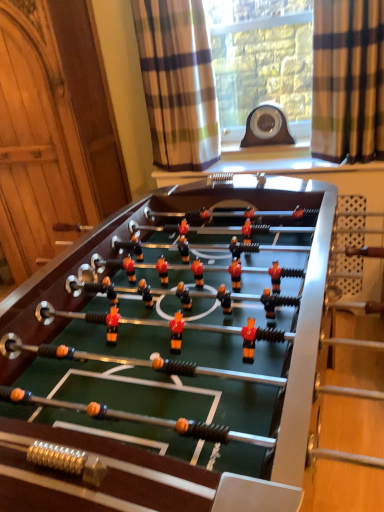
Question: Is plaid fabric curtain at upper center, the first curtain viewed from the left, at the right side of green felt table at center?

Choices:
 (A) no
 (B) yes

Answer: (A)

Question: Can you confirm if plaid fabric curtain at upper center, arranged as the 2th curtain when viewed from the right, is taller than green felt table at center?

Choices:
 (A) yes
 (B) no

Answer: (B)

Question: Does plaid fabric curtain at upper center, arranged as the 2th curtain when viewed from the right, have a smaller size compared to green felt table at center?

Choices:
 (A) no
 (B) yes

Answer: (B)

Question: Is plaid fabric curtain at upper center, arranged as the 2th curtain when viewed from the right, oriented away from green felt table at center?

Choices:
 (A) no
 (B) yes

Answer: (A)

Question: Does plaid fabric curtain at upper center, the first curtain viewed from the left, have a lesser width compared to green felt table at center?

Choices:
 (A) no
 (B) yes

Answer: (B)

Question: Is point (157, 336) positioned closer to the camera than point (155, 39)?

Choices:
 (A) farther
 (B) closer

Answer: (B)

Question: From a real-world perspective, is green felt table at center physically located above or below plaid fabric curtain at upper center, arranged as the 2th curtain when viewed from the right?

Choices:
 (A) below
 (B) above

Answer: (A)

Question: From the image's perspective, relative to plaid fabric curtain at upper center, arranged as the 2th curtain when viewed from the right, is green felt table at center above or below?

Choices:
 (A) above
 (B) below

Answer: (B)

Question: Is green felt table at center situated inside plaid fabric curtain at upper center, arranged as the 2th curtain when viewed from the right, or outside?

Choices:
 (A) outside
 (B) inside

Answer: (A)

Question: From a real-world perspective, is green felt table at center above or below brown plaid curtain at upper right, placed as the 2th curtain when sorted from left to right?

Choices:
 (A) above
 (B) below

Answer: (B)

Question: Relative to brown plaid curtain at upper right, which is the first curtain in right-to-left order, is green felt table at center in front or behind?

Choices:
 (A) front
 (B) behind

Answer: (A)

Question: From the image's perspective, relative to brown plaid curtain at upper right, placed as the 2th curtain when sorted from left to right, is green felt table at center above or below?

Choices:
 (A) above
 (B) below

Answer: (B)

Question: Considering the positions of green felt table at center and brown plaid curtain at upper right, which is the first curtain in right-to-left order, in the image, is green felt table at center bigger or smaller than brown plaid curtain at upper right, which is the first curtain in right-to-left order,?

Choices:
 (A) small
 (B) big

Answer: (B)

Question: From a real-world perspective, relative to green felt table at center, is plaid fabric curtain at upper center, the first curtain viewed from the left, vertically above or below?

Choices:
 (A) above
 (B) below

Answer: (A)

Question: In terms of size, does plaid fabric curtain at upper center, the first curtain viewed from the left, appear bigger or smaller than green felt table at center?

Choices:
 (A) big
 (B) small

Answer: (B)